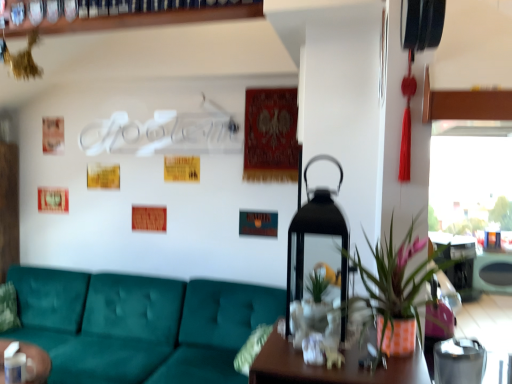
Question: Would you say wooden table at right is inside or outside teal fabric couch at lower left?

Choices:
 (A) inside
 (B) outside

Answer: (B)

Question: Would you say wooden table at right is to the left or to the right of teal fabric couch at lower left in the picture?

Choices:
 (A) right
 (B) left

Answer: (A)

Question: Considering the real-world distances, which object is closest to the transparent glass window at upper right?

Choices:
 (A) teal fabric couch at lower left
 (B) wooden table at right
 (C) orange textured pot at center

Answer: (B)

Question: Which object is the closest to the orange textured pot at center?

Choices:
 (A) wooden table at right
 (B) teal fabric couch at lower left
 (C) transparent glass window at upper right

Answer: (C)